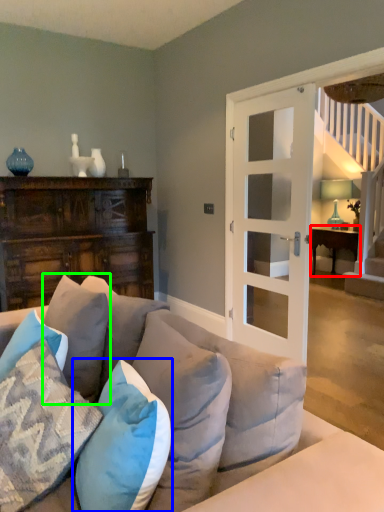
Question: Which object is positioned farthest from table (highlighted by a red box)? Select from pillow (highlighted by a blue box) and pillow (highlighted by a green box).

Choices:
 (A) pillow
 (B) pillow

Answer: (A)